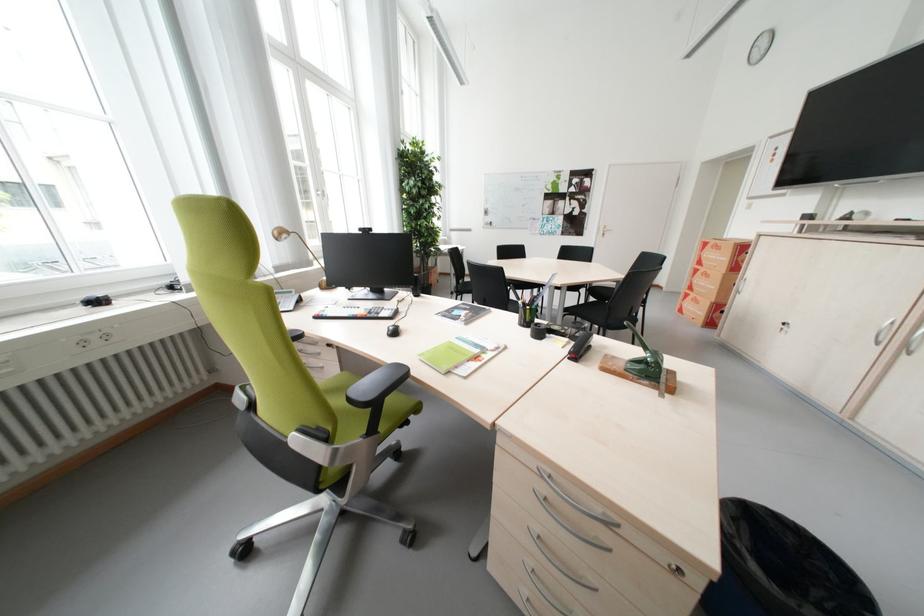
Image resolution: width=924 pixels, height=616 pixels. I want to click on black chair sitting surface, so click(594, 310).